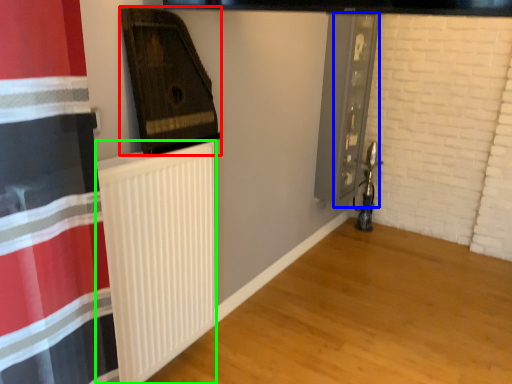
Question: Considering the real-world distances, which object is farthest from wood (highlighted by a red box)? screen door (highlighted by a blue box) or radiator (highlighted by a green box)?

Choices:
 (A) screen door
 (B) radiator

Answer: (A)